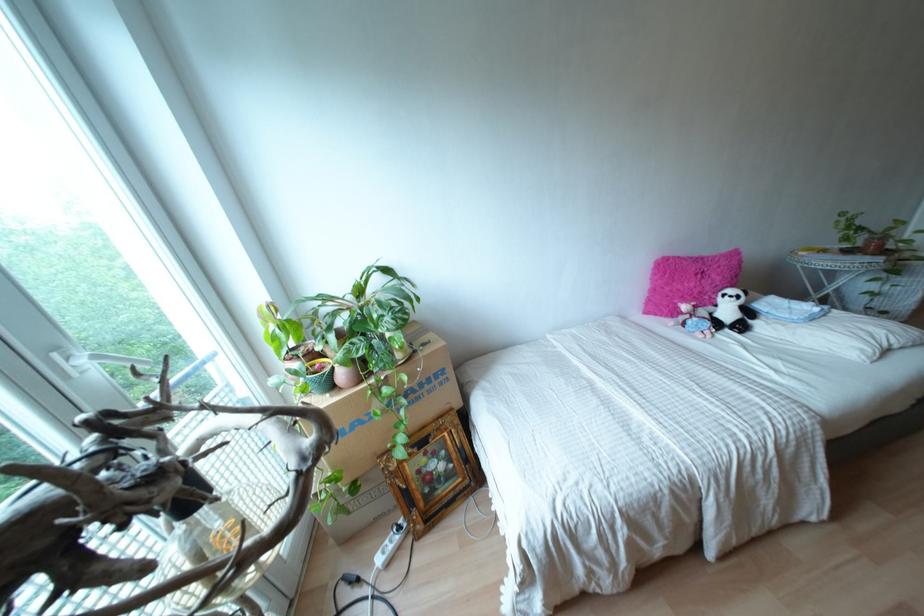
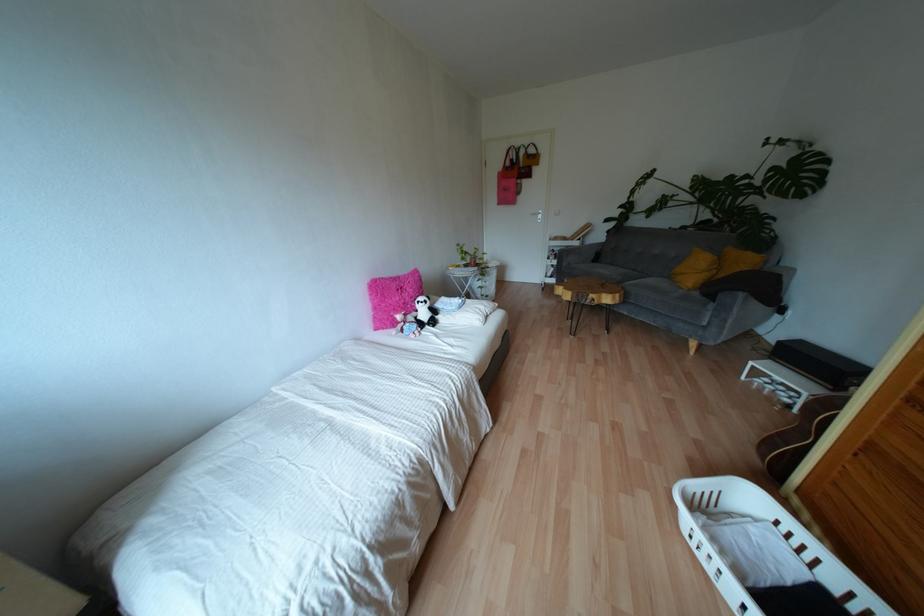
Question: The first image is from the beginning of the video and the second image is from the end. How did the camera likely rotate when shooting the video?

Choices:
 (A) Left
 (B) Right
 (C) Up
 (D) Down

Answer: (B)